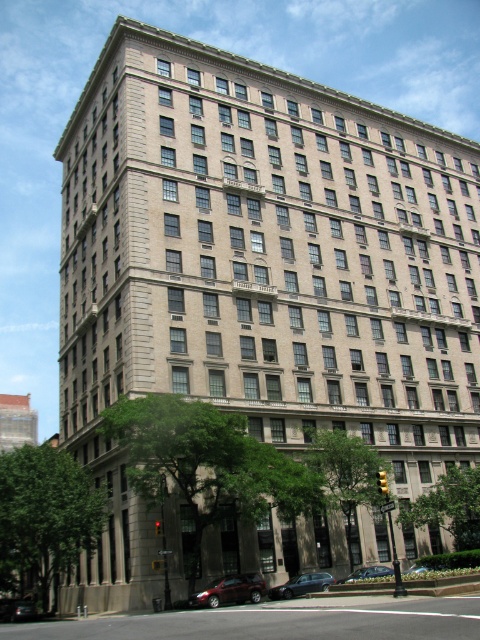
Which of these two, shiny maroon sedan at lower center or metallic silver sedan at lower center, stands shorter?

With less height is shiny maroon sedan at lower center.

Between point (207, 595) and point (357, 579), which one is positioned behind?

Point (357, 579)

This screenshot has width=480, height=640. In order to click on shiny maroon sedan at lower center in this screenshot , I will do coord(229,589).

Does metallic red car at lower left have a lesser height compared to metallic silver sedan at lower center?

Yes.

Is metallic red car at lower left thinner than metallic silver sedan at lower center?

No.

This screenshot has width=480, height=640. What do you see at coordinates (16, 609) in the screenshot?
I see `metallic red car at lower left` at bounding box center [16, 609].

The image size is (480, 640). I want to click on metallic red car at lower left, so click(16, 609).

Does shiny black sedan at lower center have a greater height compared to metallic red car at lower left?

No, shiny black sedan at lower center is not taller than metallic red car at lower left.

Which of these two, shiny black sedan at lower center or metallic red car at lower left, stands shorter?

shiny black sedan at lower center

Describe the element at coordinates (301, 584) in the screenshot. Image resolution: width=480 pixels, height=640 pixels. I see `shiny black sedan at lower center` at that location.

The width and height of the screenshot is (480, 640). In order to click on shiny black sedan at lower center in this screenshot , I will do `click(301, 584)`.